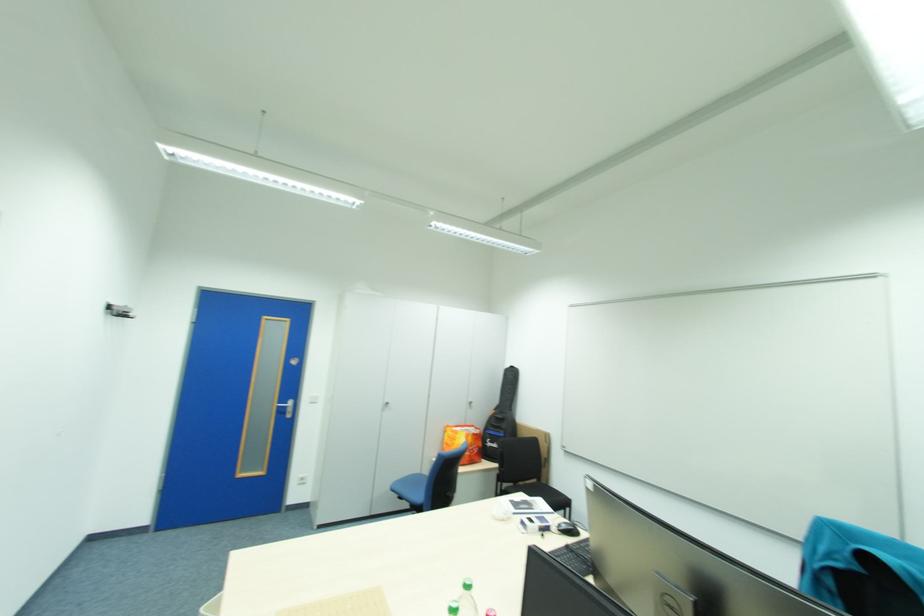
You are a GUI agent. You are given a task and a screenshot of the screen. Output one action in this format:
    pyautogui.click(x=<x>, y=<y>)
    Task: Click on the silver door handle
    The width and height of the screenshot is (924, 616).
    Given the screenshot: What is the action you would take?
    tap(286, 408)